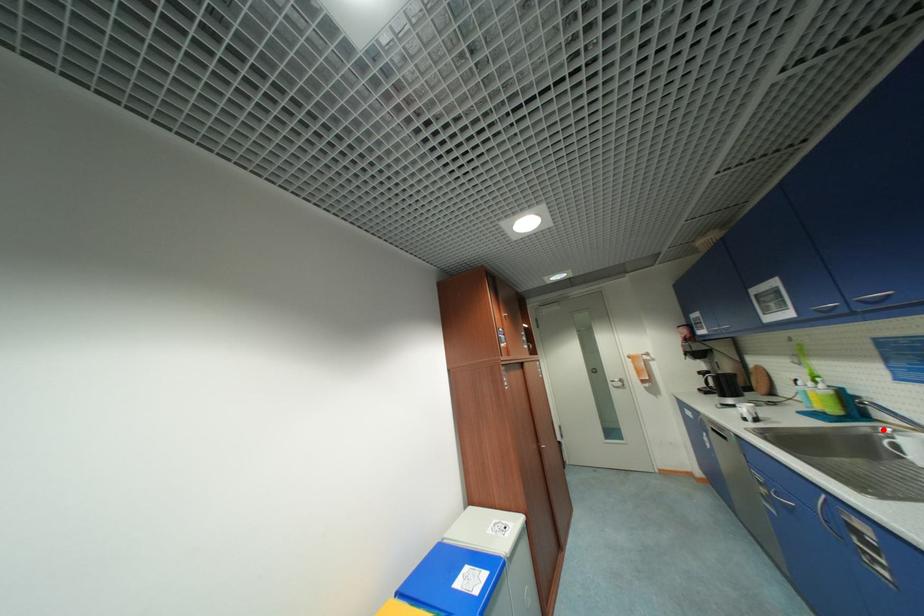
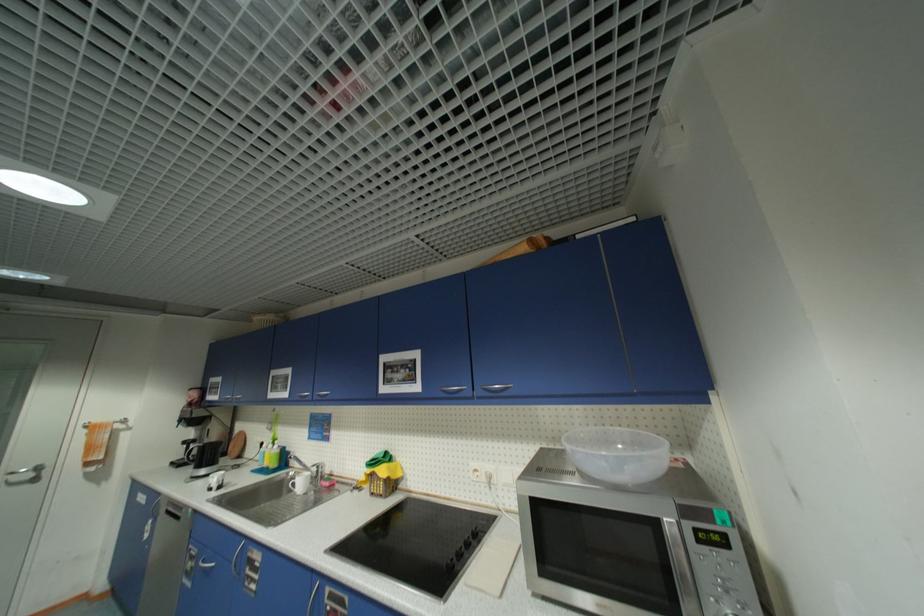
Question: I am providing you with two images of the same scene from different viewpoints. Given a red point in image1, look at the same physical point in image2. Is it:

Choices:
 (A) Closer to the viewpoint
 (B) Farther from the viewpoint

Answer: (B)